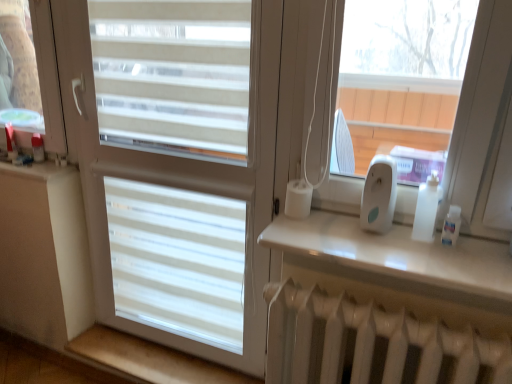
This screenshot has height=384, width=512. I want to click on free location in front of white plastic ipod at right, so click(x=411, y=258).